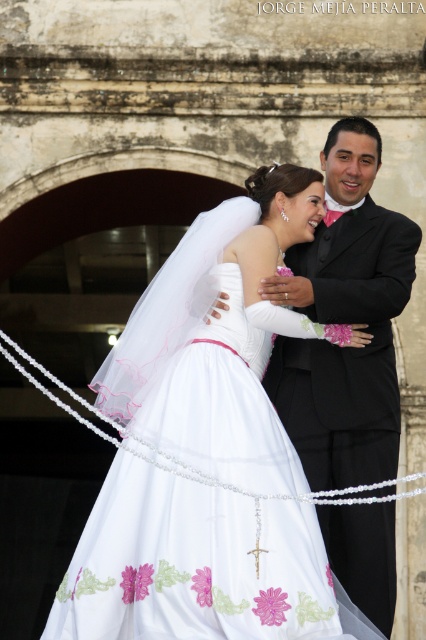
Between white satin dress at center and black satin suit at center, which one has more height?

black satin suit at center is taller.

Looking at this image, can you confirm if white satin dress at center is smaller than black satin suit at center?

Actually, white satin dress at center might be larger than black satin suit at center.

Between point (288, 177) and point (354, 168), which one is positioned in front?

Point (288, 177)

Locate an element on the screen. white satin dress at center is located at coordinates (218, 337).